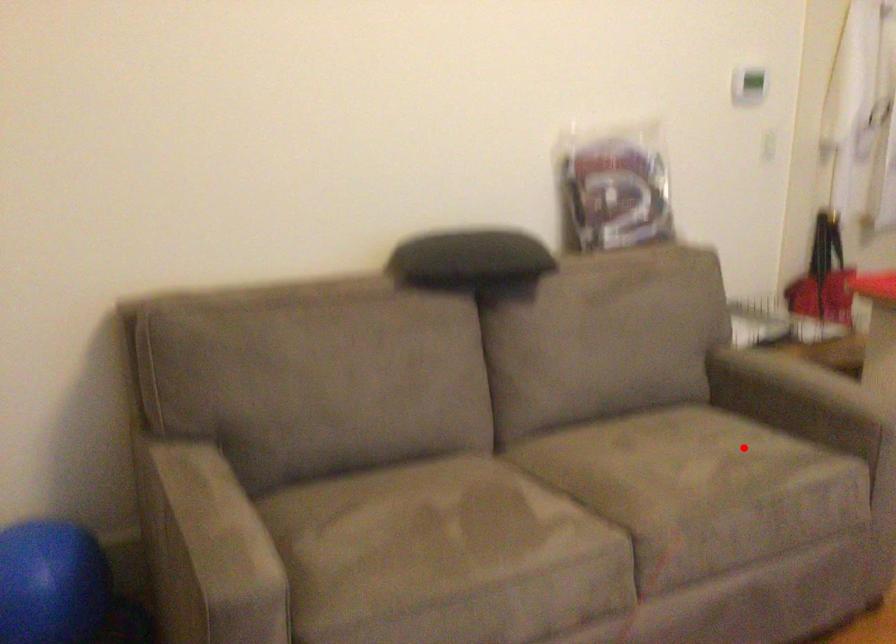
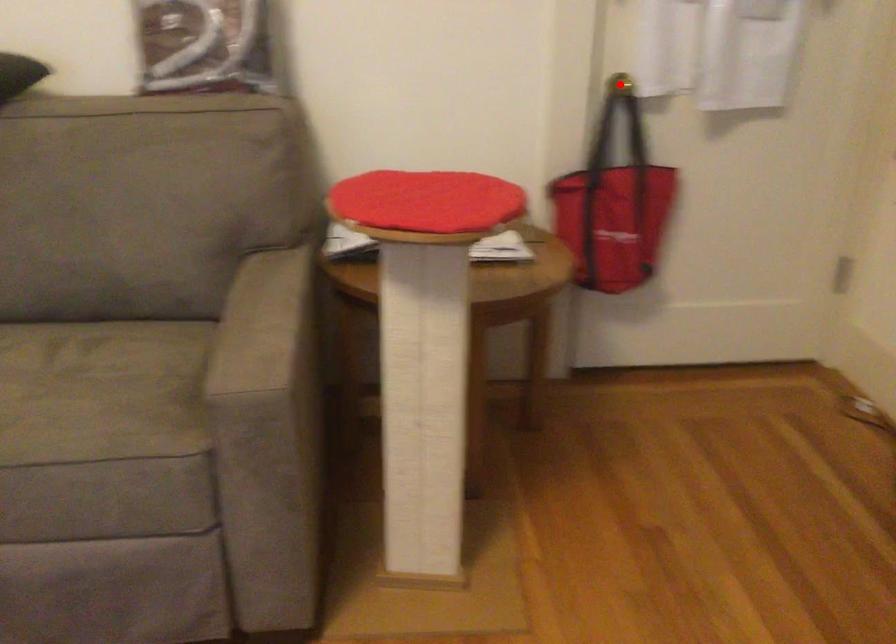
I am providing you with two images of the same scene from different viewpoints. A red point is marked on the first image and another point is marked on the second image. Is the red point in image1 aligned with the point shown in image2?

No